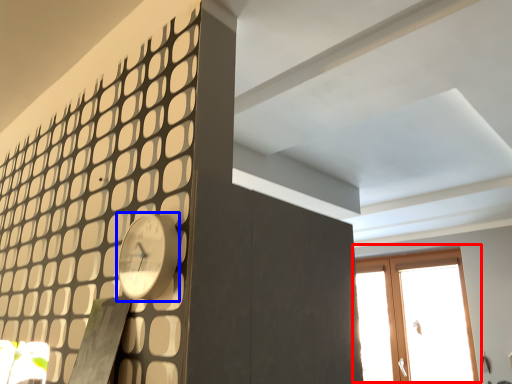
Question: Which point is closer to the camera, window (highlighted by a red box) or clock (highlighted by a blue box)?

Choices:
 (A) window
 (B) clock

Answer: (B)